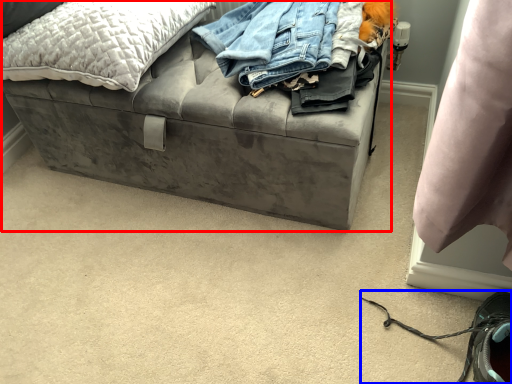
Question: Among these objects, which one is farthest to the camera, furniture (highlighted by a red box) or shoe (highlighted by a blue box)?

Choices:
 (A) furniture
 (B) shoe

Answer: (A)